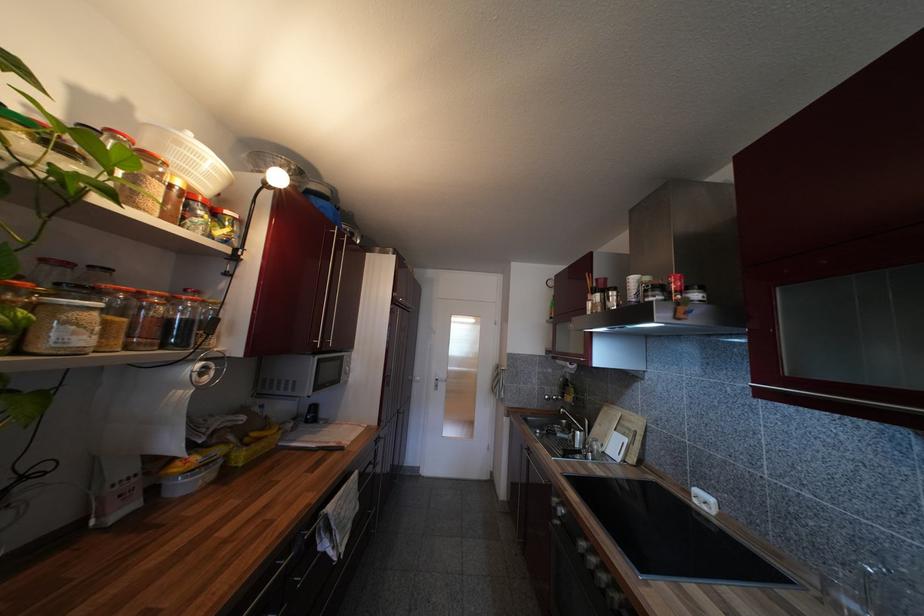
The image size is (924, 616). Identify the location of wooden cutting board. (617, 434).